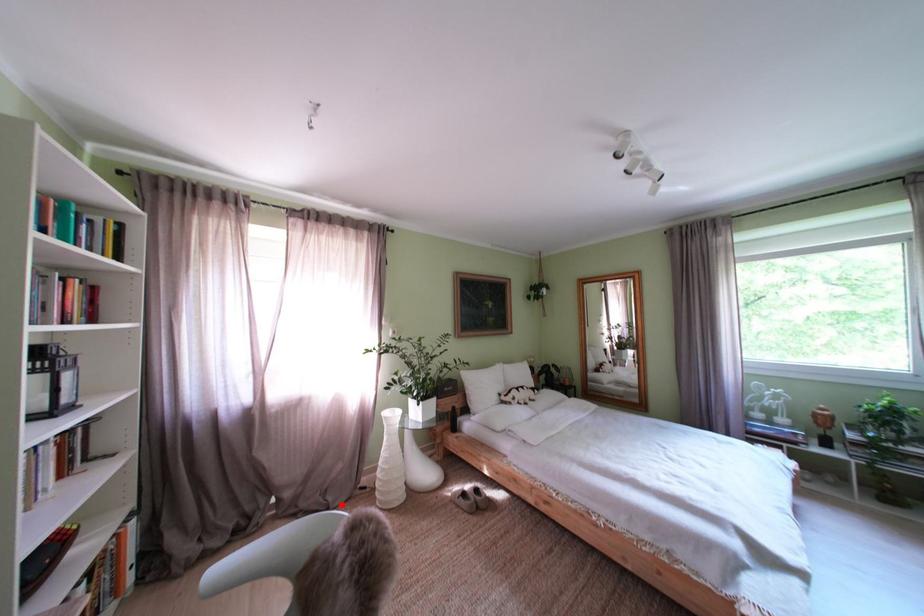
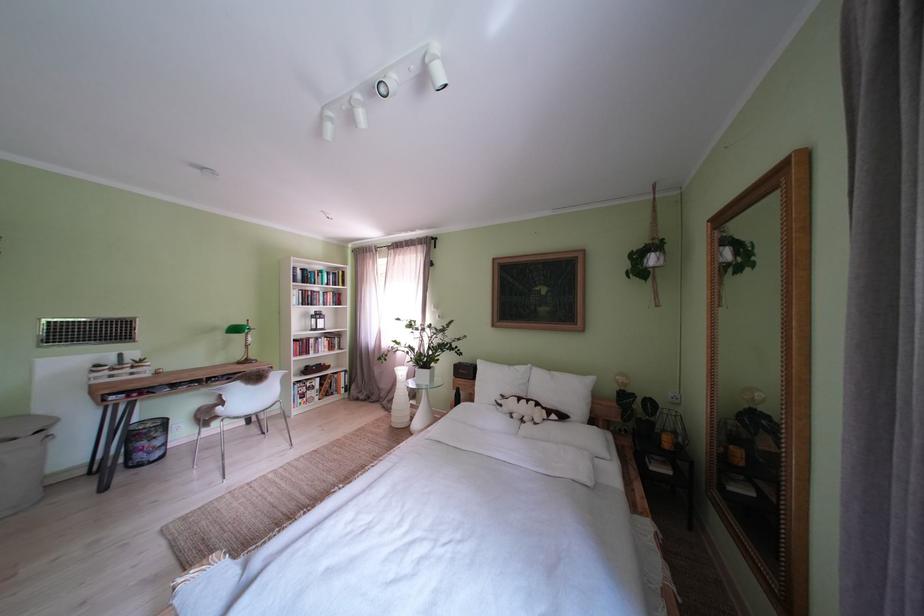
Locate, in the second image, the point that corresponds to the highlighted location in the first image.

(400, 411)